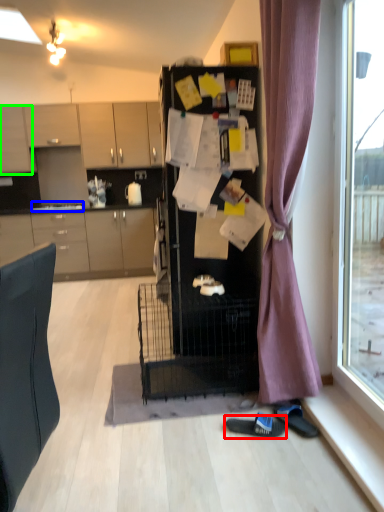
Question: Which object is positioned closest to footwear (highlighted by a red box)? Select from sink (highlighted by a blue box) and cabinetry (highlighted by a green box).

Choices:
 (A) sink
 (B) cabinetry

Answer: (A)